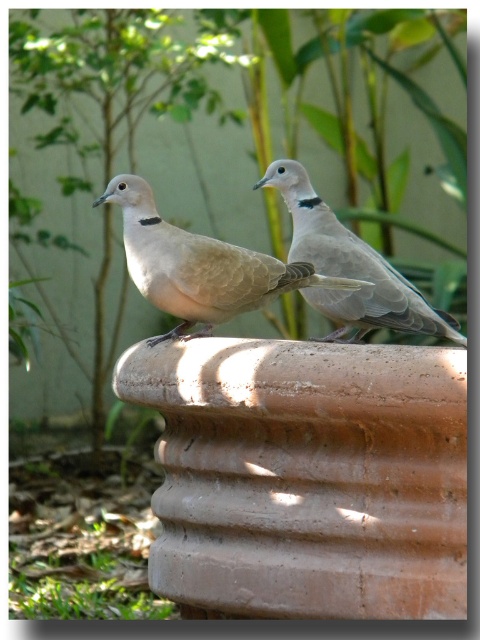
From the picture: You are a photographer trying to capture both the matte beige dove at center and the light brown feathered dove at center in a single shot. Since you want to ensure both are in focus, which dove should you focus on first considering their heights?

The matte beige dove at center has a lesser height compared to light brown feathered dove at center, so you should focus on the light brown feathered dove at center first because it is taller and might be further away from the camera, requiring proper focus adjustment.

You are a photographer trying to capture the matte beige dove at center. Based on the scene description, where should you focus your camera to ensure the dove is in sharp focus?

You should focus your camera at point (200, 266) to ensure the matte beige dove at center is in sharp focus.